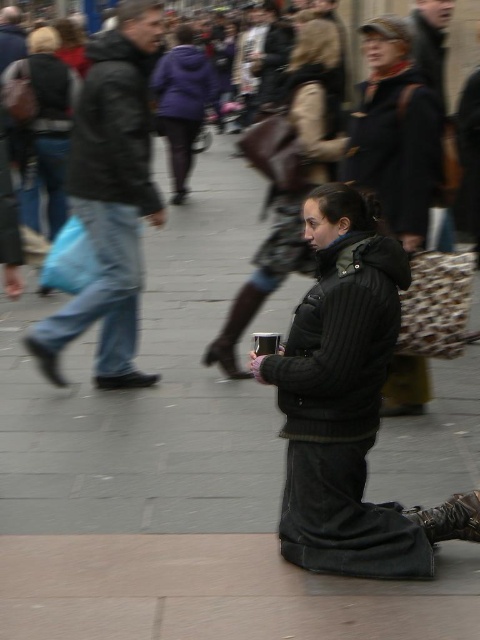
You are standing on the street and see two points marked in the scene. The first point is at coordinate point (145,204) and the second is at point (424,150). Which point is closer to you?

Point (145,204) is further to the viewer than point (424,150), so the point closer to you is point (424,150).

You are a photographer standing on the street and want to take a photo of the purple fleece jacket at center and the leather boot at lower right. Which object should you focus on first if you want to ensure both are in the frame without moving the camera?

You should focus on the purple fleece jacket at center first because it is located above the leather boot at lower right, so adjusting the camera to include the higher object first ensures the lower one will also be in frame.